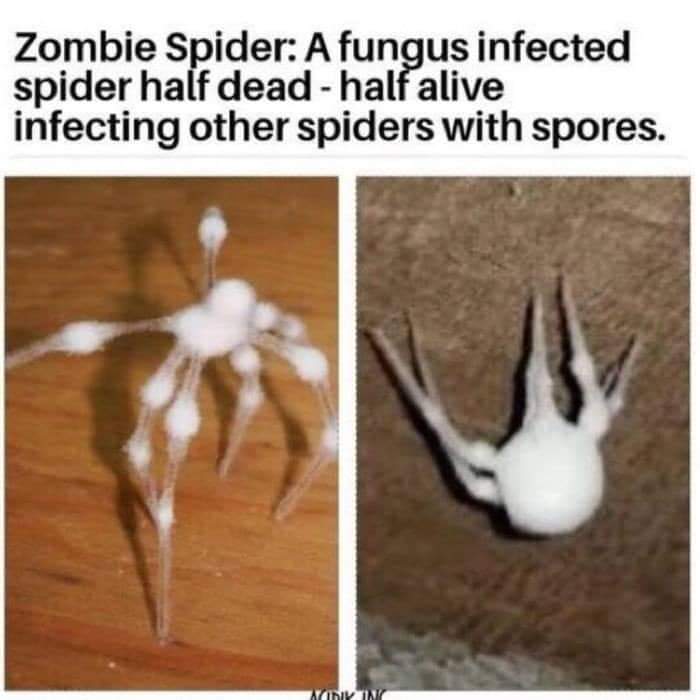
I want to click on wooden surface, so tap(49, 524).